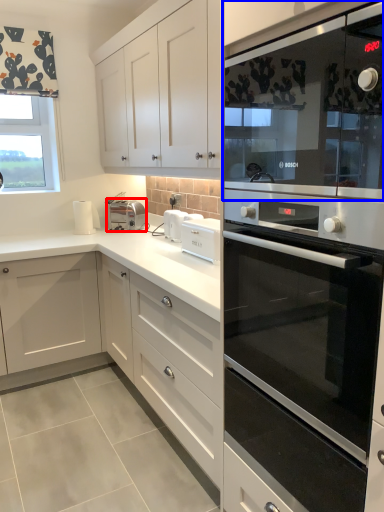
Question: Which of the following is the farthest to the observer, appliance (highlighted by a red box) or microwave oven (highlighted by a blue box)?

Choices:
 (A) appliance
 (B) microwave oven

Answer: (A)